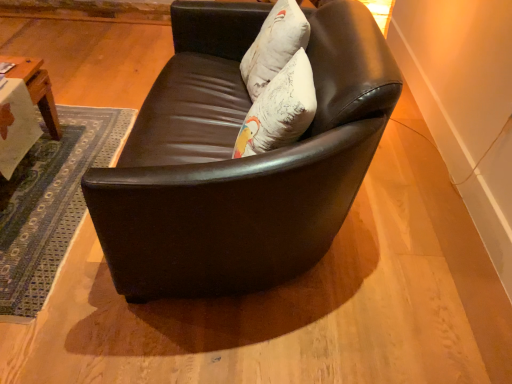
Question: In the image, is white textured pillow at upper center on the left side or the right side of matte black couch at center?

Choices:
 (A) left
 (B) right

Answer: (B)

Question: Considering their positions, is white textured pillow at upper center located in front of or behind matte black couch at center?

Choices:
 (A) front
 (B) behind

Answer: (B)

Question: In terms of width, does white textured pillow at upper center look wider or thinner when compared to matte black couch at center?

Choices:
 (A) wide
 (B) thin

Answer: (B)

Question: Considering the positions of point (247, 218) and point (295, 8), is point (247, 218) closer or farther from the camera than point (295, 8)?

Choices:
 (A) closer
 (B) farther

Answer: (A)

Question: Is matte black couch at center inside or outside of white textured pillow at upper center?

Choices:
 (A) outside
 (B) inside

Answer: (A)

Question: In terms of height, does matte black couch at center look taller or shorter compared to white textured pillow at upper center?

Choices:
 (A) short
 (B) tall

Answer: (B)

Question: In terms of size, does matte black couch at center appear bigger or smaller than white textured pillow at upper center?

Choices:
 (A) small
 (B) big

Answer: (B)